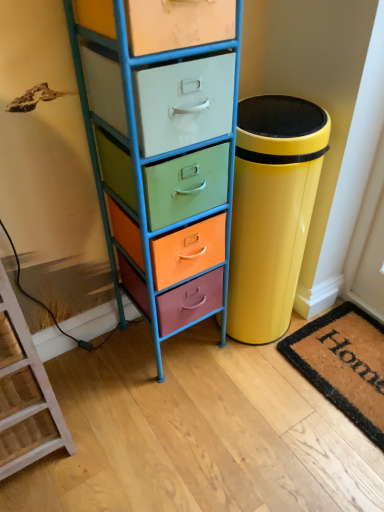
This screenshot has width=384, height=512. Find the location of `free area in between metallic multi-colored chest of drawers at left and glossy yellow trash can at right`. free area in between metallic multi-colored chest of drawers at left and glossy yellow trash can at right is located at coordinates (211, 370).